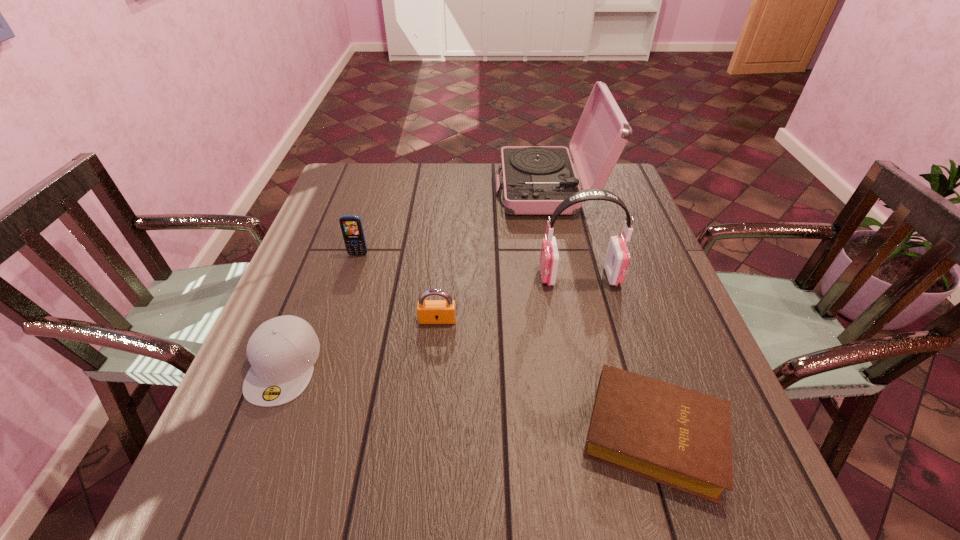
Find the location of a particular element. This screenshot has height=540, width=960. vacant point located between the Bible and the record player is located at coordinates (601, 312).

At what (x,y) coordinates should I click in order to perform the action: click on empty location between the second shortest object and the padlock. Please return your answer as a coordinate pair (x, y). Looking at the image, I should click on (361, 342).

Locate an element on the screen. The height and width of the screenshot is (540, 960). vacant area that lies between the fifth nearest object and the fifth shortest object is located at coordinates (468, 265).

Choose which object is the fifth nearest neighbor to the shortest object. Please provide its 2D coordinates. Your answer should be formatted as a tuple, i.e. [(x, y)], where the tuple contains the x and y coordinates of a point satisfying the conditions above.

[(351, 226)]

Locate which object ranks fifth in proximity to the padlock. Please provide its 2D coordinates. Your answer should be formatted as a tuple, i.e. [(x, y)], where the tuple contains the x and y coordinates of a point satisfying the conditions above.

[(536, 179)]

Image resolution: width=960 pixels, height=540 pixels. What are the coordinates of `vacant point that satisfies the following two spatial constraints: 1. on the screen of the Bible; 2. on the right side of the fourth shortest object` in the screenshot? It's located at (301, 435).

Identify the location of vacant space that satisfies the following two spatial constraints: 1. on the outer surface of the second tallest object; 2. to unlock the fourth object from right to left from the front. (590, 320).

Where is `free location that satisfies the following two spatial constraints: 1. on the screen of the shortest object; 2. on the right side of the second farthest object`? This screenshot has width=960, height=540. free location that satisfies the following two spatial constraints: 1. on the screen of the shortest object; 2. on the right side of the second farthest object is located at coordinates (x=301, y=435).

You are a GUI agent. You are given a task and a screenshot of the screen. Output one action in this format:
    pyautogui.click(x=<x>, y=<y>)
    Task: Click on the free space that satisfies the following two spatial constraints: 1. with the lid open on the record player; 2. to unlock the fourth farthest object from the front
    The width and height of the screenshot is (960, 540).
    Given the screenshot: What is the action you would take?
    tap(576, 320)

Image resolution: width=960 pixels, height=540 pixels. In order to click on free space that satisfies the following two spatial constraints: 1. on the outer surface of the fifth shortest object; 2. on the front-facing side of the fifth tallest object in this screenshot , I will do `click(601, 365)`.